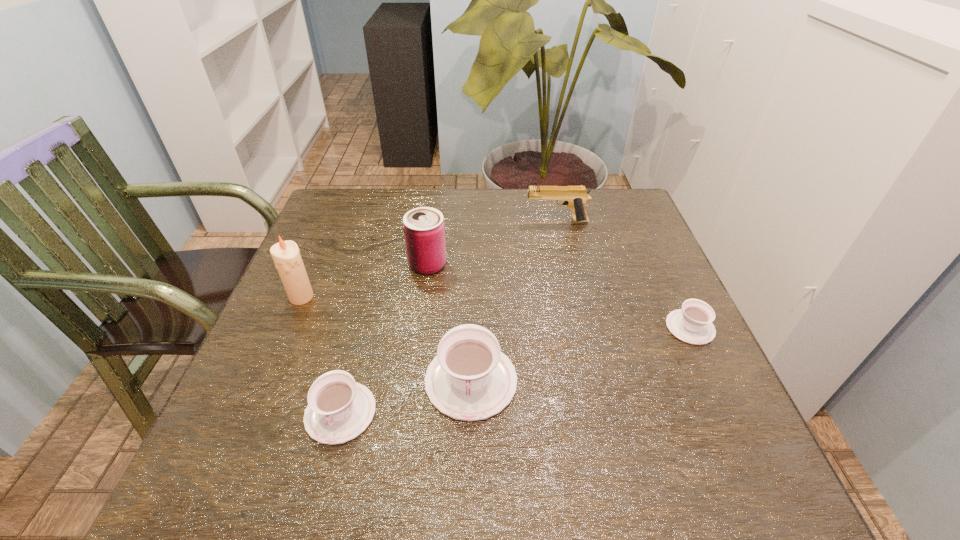
Find the location of a particular element. object at the far edge is located at coordinates (575, 197).

The width and height of the screenshot is (960, 540). I want to click on teacup located at the left edge, so click(339, 409).

At what (x,y) coordinates should I click in order to perform the action: click on candle present at the left edge. Please return your answer as a coordinate pair (x, y). The height and width of the screenshot is (540, 960). Looking at the image, I should click on (286, 255).

I want to click on teacup that is at the right edge, so click(692, 324).

Locate an element on the screen. pistol present at the right edge is located at coordinates (575, 197).

Locate an element on the screen. object present at the near left corner is located at coordinates (339, 409).

Find the location of a particular element. This screenshot has height=540, width=960. object that is positioned at the far right corner is located at coordinates (575, 197).

At what (x,y) coordinates should I click in order to perform the action: click on vacant space at the far edge of the desktop. Please return your answer as a coordinate pair (x, y). The height and width of the screenshot is (540, 960). Looking at the image, I should click on (522, 215).

Identify the location of vacant space at the near edge. The width and height of the screenshot is (960, 540). (597, 409).

At what (x,y) coordinates should I click in order to perform the action: click on vacant area at the left edge. Please return your answer as a coordinate pair (x, y). Looking at the image, I should click on (277, 318).